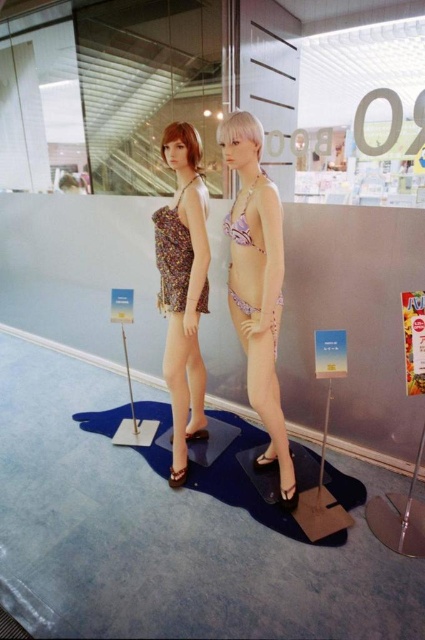
Question: Considering the real-world distances, which object is closest to the printed fabric dress at center?

Choices:
 (A) purple floral bikini top at center
 (B) transparent glass mannequin at upper center

Answer: (A)

Question: Which object is the farthest from the transparent glass mannequin at upper center?

Choices:
 (A) pink floral bikini at center
 (B) purple floral bikini top at center
 (C) floral fabric underwear at center
 (D) pink satin underwear at center

Answer: (D)

Question: Which object is the closest to the metallic pole at center?

Choices:
 (A) pink floral bikini at center
 (B) floral fabric underwear at center

Answer: (A)

Question: Is pink floral bikini at center above metallic pole at center?

Choices:
 (A) no
 (B) yes

Answer: (B)

Question: Can you confirm if printed fabric dress at center is positioned to the left of purple floral bikini top at center?

Choices:
 (A) no
 (B) yes

Answer: (B)

Question: Does printed fabric dress at center appear over pink satin underwear at center?

Choices:
 (A) no
 (B) yes

Answer: (B)